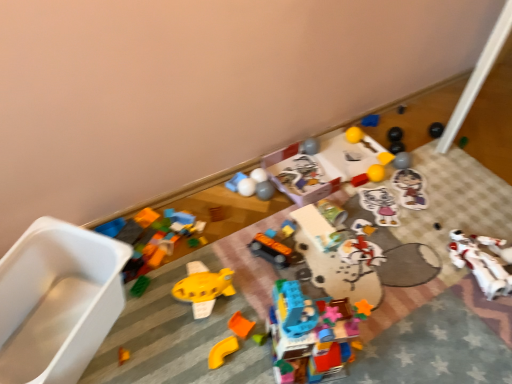
This screenshot has width=512, height=384. What do you see at coordinates (57, 301) in the screenshot? I see `white plastic container at left, which is counted as the first toy, starting from the left` at bounding box center [57, 301].

You are a GUI agent. You are given a task and a screenshot of the screen. Output one action in this format:
    pyautogui.click(x=<x>, y=<y>)
    Task: Click on the translucent plastic building blocks at center, which ranks as the ninth toy in right-to-left order
    Image resolution: width=512 pixels, height=384 pixels.
    Given the screenshot: What is the action you would take?
    pyautogui.click(x=311, y=333)

Describe the element at coordinates (311, 333) in the screenshot. I see `translucent plastic building blocks at center, which ranks as the ninth toy in right-to-left order` at that location.

This screenshot has width=512, height=384. Describe the element at coordinates (203, 288) in the screenshot. I see `yellow matte toy boat at center, positioned as the second toy in left-to-right order` at that location.

What do you see at coordinates (481, 262) in the screenshot?
I see `white plastic robot at lower right, which appears as the seventeenth toy when viewed from the left` at bounding box center [481, 262].

The width and height of the screenshot is (512, 384). What are the coordinates of `white plastic robot at lower right, the first toy positioned from the right` in the screenshot? It's located at (481, 262).

The width and height of the screenshot is (512, 384). What are the coordinates of `yellow rubber ball at upper center, the twelfth toy viewed from the left` in the screenshot? It's located at (354, 135).

Where is `white plastic container at left, which is counted as the first toy, starting from the left`? white plastic container at left, which is counted as the first toy, starting from the left is located at coordinates [x=57, y=301].

Looking at this image, in terms of height, does orange matte block at center, which is the thirteenth toy from right to left, look taller or shorter compared to white matte ball at center, which ranks as the twelfth toy in right-to-left order?

Considering their sizes, orange matte block at center, which is the thirteenth toy from right to left, has less height than white matte ball at center, which ranks as the twelfth toy in right-to-left order.

How different are the orientations of orange matte block at center, which ranks as the fifth toy in left-to-right order, and white matte ball at center, which ranks as the twelfth toy in right-to-left order, in degrees?

They differ by 16.4 degrees in their facing directions.

Which object is further away from the camera, orange matte block at center, which is the thirteenth toy from right to left, or white matte ball at center, which ranks as the twelfth toy in right-to-left order?

white matte ball at center, which ranks as the twelfth toy in right-to-left order, is further from the camera.

Is orange matte block at center, which ranks as the fifth toy in left-to-right order, facing away from white matte ball at center, which ranks as the twelfth toy in right-to-left order?

orange matte block at center, which ranks as the fifth toy in left-to-right order, does not have its back to white matte ball at center, which ranks as the twelfth toy in right-to-left order.

Measure the distance between white plastic robot at lower right, the first toy positioned from the right, and white plastic container at left, the seventeenth toy when ordered from right to left.

4.02 feet.

From the image's perspective, is white plastic robot at lower right, the first toy positioned from the right, positioned above or below white plastic container at left, which is counted as the first toy, starting from the left?

Clearly, from the image's perspective, white plastic robot at lower right, the first toy positioned from the right, is above white plastic container at left, which is counted as the first toy, starting from the left.

Considering the sizes of white plastic robot at lower right, the first toy positioned from the right, and white plastic container at left, the seventeenth toy when ordered from right to left, in the image, is white plastic robot at lower right, the first toy positioned from the right, wider or thinner than white plastic container at left, the seventeenth toy when ordered from right to left,?

Considering their sizes, white plastic robot at lower right, the first toy positioned from the right, looks slimmer than white plastic container at left, the seventeenth toy when ordered from right to left.

Is point (477, 240) closer or farther from the camera than point (24, 358)?

Clearly, point (477, 240) is more distant from the camera than point (24, 358).

Identify the location of the 2nd toy positioned above the matte white plush cat at center, marked as the fifth toy in a right-to-left arrangement (from a real-world perspective). The width and height of the screenshot is (512, 384). (385, 158).

Is yellow rubber ball at upper center, acting as the fifteenth toy starting from the left, looking in the opposite direction of matte white plush cat at center, marked as the fifth toy in a right-to-left arrangement?

yellow rubber ball at upper center, acting as the fifteenth toy starting from the left, does not have its back to matte white plush cat at center, marked as the fifth toy in a right-to-left arrangement.

From the image's perspective, would you say yellow rubber ball at upper center, acting as the fifteenth toy starting from the left, is positioned over matte white plush cat at center, the thirteenth toy viewed from the left?

Correct, yellow rubber ball at upper center, acting as the fifteenth toy starting from the left, appears higher than matte white plush cat at center, the thirteenth toy viewed from the left, in the image.

Considering the points (388, 157) and (370, 200), which point is behind, point (388, 157) or point (370, 200)?

Point (388, 157)

Could you tell me if translucent plastic building blocks at center, which ranks as the ninth toy in right-to-left order, is facing yellow rubber ball at upper center, the 3th toy in the right-to-left sequence?

No, translucent plastic building blocks at center, which ranks as the ninth toy in right-to-left order, is not turned towards yellow rubber ball at upper center, the 3th toy in the right-to-left sequence.

Between translucent plastic building blocks at center, the 9th toy positioned from the left, and yellow rubber ball at upper center, acting as the fifteenth toy starting from the left, which one has smaller size?

With smaller size is yellow rubber ball at upper center, acting as the fifteenth toy starting from the left.

Consider the image. How far apart are translucent plastic building blocks at center, which ranks as the ninth toy in right-to-left order, and yellow rubber ball at upper center, acting as the fifteenth toy starting from the left?

A distance of 35.90 inches exists between translucent plastic building blocks at center, which ranks as the ninth toy in right-to-left order, and yellow rubber ball at upper center, acting as the fifteenth toy starting from the left.

Which of these two, translucent plastic building blocks at center, which ranks as the ninth toy in right-to-left order, or yellow rubber ball at upper center, acting as the fifteenth toy starting from the left, is thinner?

With smaller width is yellow rubber ball at upper center, acting as the fifteenth toy starting from the left.

Is point (329, 248) farther from camera compared to point (420, 197)?

No, (329, 248) is in front of (420, 197).

Is metallic silver can at center, marked as the 10th toy in a left-to-right arrangement, smaller than matte plastic sticker at center, which is the second toy in right-to-left order?

No.

Is metallic silver can at center, arranged as the 8th toy when viewed from the right, facing towards matte plastic sticker at center, which is the second toy in right-to-left order?

No, metallic silver can at center, arranged as the 8th toy when viewed from the right, is not oriented towards matte plastic sticker at center, which is the second toy in right-to-left order.

Looking at this image, is metallic silver can at center, arranged as the 8th toy when viewed from the right, taller or shorter than matte plastic sticker at center, positioned as the 16th toy in left-to-right order?

metallic silver can at center, arranged as the 8th toy when viewed from the right, is taller than matte plastic sticker at center, positioned as the 16th toy in left-to-right order.

Between matte black car at center, the eighth toy positioned from the left, and yellow rubber ball at upper center, the twelfth toy viewed from the left, which one has less height?

Standing shorter between the two is yellow rubber ball at upper center, the twelfth toy viewed from the left.

Is matte black car at center, the tenth toy positioned from the right, in contact with yellow rubber ball at upper center, the twelfth toy viewed from the left?

No.

Between matte black car at center, the tenth toy positioned from the right, and yellow rubber ball at upper center, which appears as the 6th toy when viewed from the right, which one has smaller size?

With smaller size is yellow rubber ball at upper center, which appears as the 6th toy when viewed from the right.

Is matte black car at center, the tenth toy positioned from the right, positioned behind yellow rubber ball at upper center, the twelfth toy viewed from the left?

That is False.

Could you measure the distance between yellow rubber ball at upper center, which appears as the 6th toy when viewed from the right, and orange matte block at center, which ranks as the fifth toy in left-to-right order?

yellow rubber ball at upper center, which appears as the 6th toy when viewed from the right, is 38.78 inches from orange matte block at center, which ranks as the fifth toy in left-to-right order.

From their relative heights in the image, would you say yellow rubber ball at upper center, the twelfth toy viewed from the left, is taller or shorter than orange matte block at center, which ranks as the fifth toy in left-to-right order?

Considering their sizes, yellow rubber ball at upper center, the twelfth toy viewed from the left, has more height than orange matte block at center, which ranks as the fifth toy in left-to-right order.

Which object is thinner, yellow rubber ball at upper center, the twelfth toy viewed from the left, or orange matte block at center, which ranks as the fifth toy in left-to-right order?

orange matte block at center, which ranks as the fifth toy in left-to-right order, is thinner.

From the image's perspective, is yellow rubber ball at upper center, the twelfth toy viewed from the left, located above orange matte block at center, which ranks as the fifth toy in left-to-right order?

Yes, from the image's perspective, yellow rubber ball at upper center, the twelfth toy viewed from the left, is on top of orange matte block at center, which ranks as the fifth toy in left-to-right order.

I want to click on the 7th toy in front when counting from the white matte ball at center, which ranks as the twelfth toy in right-to-left order, so click(x=240, y=325).

Which toy is the 16th one when counting from the left side of the white plastic robot at lower right, the first toy positioned from the right? Please provide its 2D coordinates.

[(57, 301)]

Based on their spatial positions, is metallic silver can at center, arranged as the 8th toy when viewed from the right, or matte black car at center, the eighth toy positioned from the left, closer to white matte ball at center, arranged as the 6th toy when viewed from the left?

Among the two, matte black car at center, the eighth toy positioned from the left, is located nearer to white matte ball at center, arranged as the 6th toy when viewed from the left.

When comparing their distances from blue matte block at upper center, positioned as the 4th toy in right-to-left order, does white matte ball at center, which ranks as the twelfth toy in right-to-left order, or white plastic robot at lower right, the first toy positioned from the right, seem closer?

white matte ball at center, which ranks as the twelfth toy in right-to-left order, is closer to blue matte block at upper center, positioned as the 4th toy in right-to-left order.

Considering their positions, is orange matte block at center, which ranks as the fifth toy in left-to-right order, positioned closer to metallic silver can at center, marked as the 10th toy in a left-to-right arrangement, than yellow rubber ball at upper center, which appears as the 6th toy when viewed from the right?

Among the two, orange matte block at center, which ranks as the fifth toy in left-to-right order, is located nearer to metallic silver can at center, marked as the 10th toy in a left-to-right arrangement.

Based on their spatial positions, is white plastic container at left, the seventeenth toy when ordered from right to left, or orange matte block at center, which ranks as the fifth toy in left-to-right order, closer to blue matte block at upper center, positioned as the 4th toy in right-to-left order?

Among the two, orange matte block at center, which ranks as the fifth toy in left-to-right order, is located nearer to blue matte block at upper center, positioned as the 4th toy in right-to-left order.

Which object lies nearer to the anchor point white matte ball at center, which ranks as the twelfth toy in right-to-left order, matte black car at center, the tenth toy positioned from the right, or orange matte block at center, which is the thirteenth toy from right to left?

matte black car at center, the tenth toy positioned from the right, is positioned closer to the anchor white matte ball at center, which ranks as the twelfth toy in right-to-left order.

Estimate the real-world distances between objects in this image. Which object is further from orange matte block at center, which is the thirteenth toy from right to left, translucent plastic building blocks at center, which ranks as the ninth toy in right-to-left order, or metallic silver can at center, arranged as the 8th toy when viewed from the right?

Based on the image, metallic silver can at center, arranged as the 8th toy when viewed from the right, appears to be further to orange matte block at center, which is the thirteenth toy from right to left.

Looking at this image, based on their spatial positions, is blue matte block at upper center, positioned as the 4th toy in right-to-left order, or yellow rubber ball at upper center, acting as the fifteenth toy starting from the left, further from yellow rubber ball at upper center, which appears as the 6th toy when viewed from the right?

Among the two, yellow rubber ball at upper center, acting as the fifteenth toy starting from the left, is located further to yellow rubber ball at upper center, which appears as the 6th toy when viewed from the right.

Estimate the real-world distances between objects in this image. Which object is closer to yellow rubber ball at upper center, which appears as the 6th toy when viewed from the right, metallic silver can at center, the eleventh toy positioned from the left, or matte white plush cat at center, the thirteenth toy viewed from the left?

The object closer to yellow rubber ball at upper center, which appears as the 6th toy when viewed from the right, is matte white plush cat at center, the thirteenth toy viewed from the left.

Image resolution: width=512 pixels, height=384 pixels. I want to click on toy between blue matte block at upper center, positioned as the 4th toy in right-to-left order, and yellow rubber ball at upper center, acting as the fifteenth toy starting from the left, in the vertical direction, so click(354, 135).

The width and height of the screenshot is (512, 384). In order to click on toy between white plastic container at left, which is counted as the first toy, starting from the left, and orange matte plastic toy at lower center, the third toy when ordered from left to right, from left to right in this screenshot , I will do `click(203, 288)`.